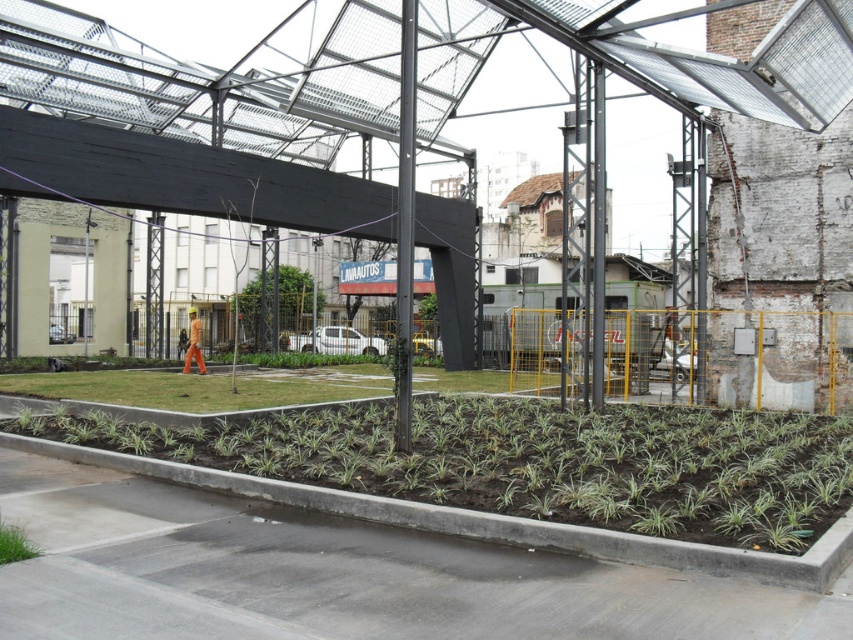
Is green leafy plants at lower center positioned behind green grass at lower left?

Yes, green leafy plants at lower center is behind green grass at lower left.

Consider the image. Is green leafy plants at lower center to the right of green grass at lower left from the viewer's perspective?

Yes, green leafy plants at lower center is to the right of green grass at lower left.

Is point (352, 486) positioned before point (12, 550)?

No.

Image resolution: width=853 pixels, height=640 pixels. In order to click on green leafy plants at lower center in this screenshot , I will do `click(532, 461)`.